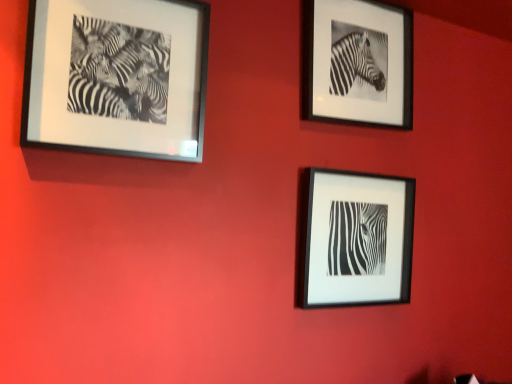
Question: Is black matte frame at upper right, which appears as the 3th picture frame when viewed from the left, taller than black matte frame at center, the 2th picture frame in the left-to-right sequence?

Choices:
 (A) no
 (B) yes

Answer: (B)

Question: Is black matte frame at upper right, the first picture frame from the right, smaller than black matte frame at center, which appears as the second picture frame when viewed from the right?

Choices:
 (A) no
 (B) yes

Answer: (B)

Question: Considering the relative sizes of black matte frame at upper right, which appears as the 3th picture frame when viewed from the left, and black matte frame at center, which appears as the second picture frame when viewed from the right, in the image provided, is black matte frame at upper right, which appears as the 3th picture frame when viewed from the left, bigger than black matte frame at center, which appears as the second picture frame when viewed from the right,?

Choices:
 (A) no
 (B) yes

Answer: (A)

Question: From a real-world perspective, is black matte frame at upper right, which appears as the 3th picture frame when viewed from the left, beneath black matte frame at center, which appears as the second picture frame when viewed from the right?

Choices:
 (A) no
 (B) yes

Answer: (A)

Question: From the image's perspective, would you say black matte frame at upper right, the first picture frame from the right, is shown under black matte frame at center, which appears as the second picture frame when viewed from the right?

Choices:
 (A) no
 (B) yes

Answer: (A)

Question: Is black matte frame at upper right, the first picture frame from the right, taller or shorter than black matte frame at center, the 2th picture frame in the left-to-right sequence?

Choices:
 (A) short
 (B) tall

Answer: (B)

Question: In the image, is black matte frame at upper right, which appears as the 3th picture frame when viewed from the left, on the left side or the right side of black matte frame at center, which appears as the second picture frame when viewed from the right?

Choices:
 (A) right
 (B) left

Answer: (A)

Question: Considering the positions of black matte frame at upper right, which appears as the 3th picture frame when viewed from the left, and black matte frame at center, the 2th picture frame in the left-to-right sequence, in the image, is black matte frame at upper right, which appears as the 3th picture frame when viewed from the left, wider or thinner than black matte frame at center, the 2th picture frame in the left-to-right sequence,?

Choices:
 (A) wide
 (B) thin

Answer: (B)

Question: From a real-world perspective, is black matte frame at upper right, the first picture frame from the right, above or below black matte frame at center, which appears as the second picture frame when viewed from the right?

Choices:
 (A) above
 (B) below

Answer: (A)

Question: Is black matte photo frame at upper left, which is the first picture frame from left to right, bigger or smaller than black matte frame at upper right, the first picture frame from the right?

Choices:
 (A) big
 (B) small

Answer: (A)

Question: Is point (101, 145) closer or farther from the camera than point (365, 8)?

Choices:
 (A) farther
 (B) closer

Answer: (B)

Question: Based on their positions, is black matte photo frame at upper left, which is the first picture frame from left to right, located to the left or right of black matte frame at upper right, the first picture frame from the right?

Choices:
 (A) right
 (B) left

Answer: (B)

Question: Is black matte photo frame at upper left, the 3th picture frame positioned from the right, taller or shorter than black matte frame at upper right, the first picture frame from the right?

Choices:
 (A) tall
 (B) short

Answer: (B)

Question: From a real-world perspective, relative to black matte frame at upper right, the first picture frame from the right, is black matte frame at center, the 2th picture frame in the left-to-right sequence, vertically above or below?

Choices:
 (A) above
 (B) below

Answer: (B)

Question: Is black matte frame at center, which appears as the second picture frame when viewed from the right, bigger or smaller than black matte frame at upper right, the first picture frame from the right?

Choices:
 (A) small
 (B) big

Answer: (B)